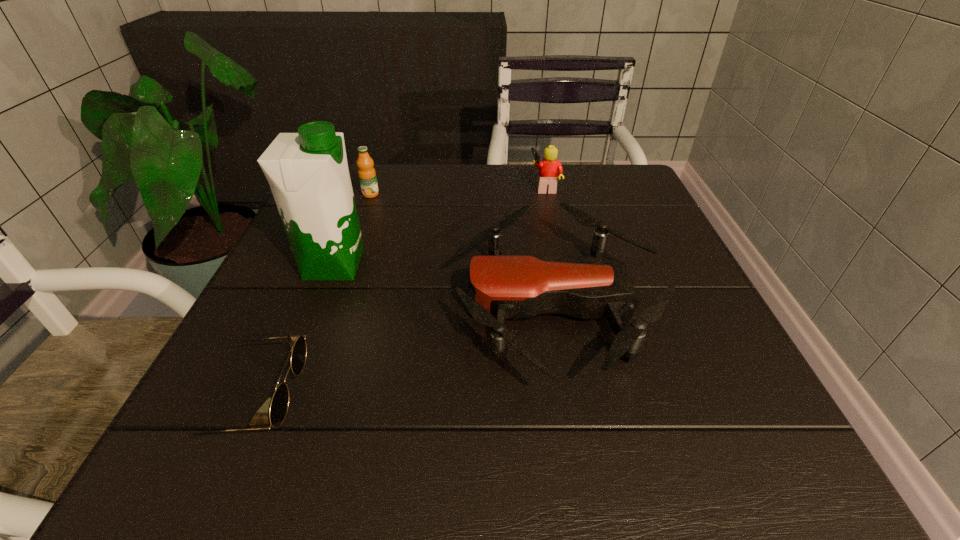
Identify the location of free spot that satisfies the following two spatial constraints: 1. in front of the Lego with the accessory visible; 2. on the label of the orange juice. The height and width of the screenshot is (540, 960). (546, 194).

The height and width of the screenshot is (540, 960). What are the coordinates of `vacant region that satisfies the following two spatial constraints: 1. on the label of the orange juice; 2. on the front-facing side of the tallest object` in the screenshot? It's located at (346, 265).